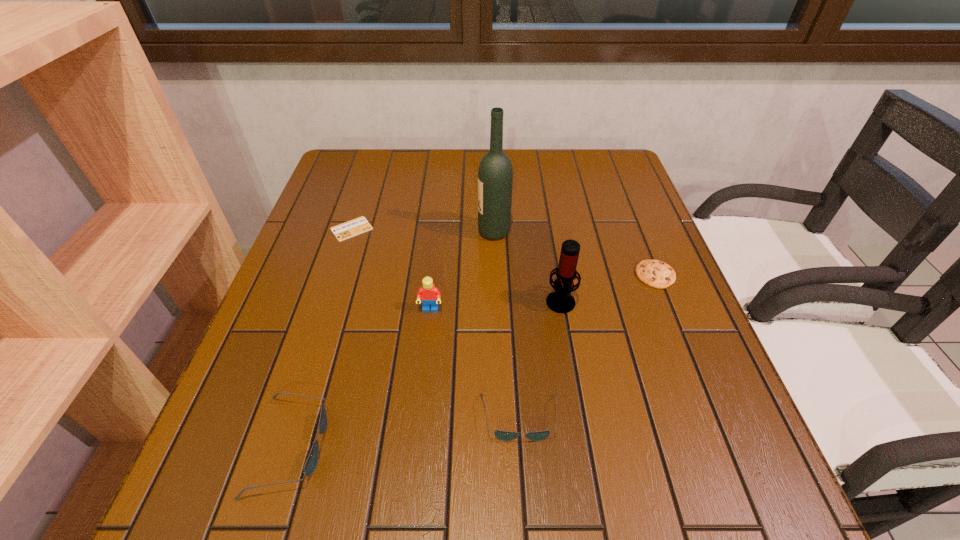
Where is `the fifth shortest object`? the fifth shortest object is located at coordinates (429, 294).

Where is `the fifth object from right to left`? Image resolution: width=960 pixels, height=540 pixels. the fifth object from right to left is located at coordinates (429, 294).

You are a GUI agent. You are given a task and a screenshot of the screen. Output one action in this format:
    pyautogui.click(x=<x>, y=<y>)
    Task: Click on the vacant space located on the lenses of the left sunglasses
    The image size is (960, 540).
    Given the screenshot: What is the action you would take?
    pyautogui.click(x=492, y=446)

Locate an element on the screen. vacant area located on the labeled side of the wine bottle is located at coordinates (377, 232).

Where is `free space located 0.400m on the labeled side of the wine bottle`? free space located 0.400m on the labeled side of the wine bottle is located at coordinates (323, 232).

Locate an element on the screen. blank space located on the labeled side of the wine bottle is located at coordinates (381, 232).

Where is `vacant region located on the back of the shortest object`? The image size is (960, 540). vacant region located on the back of the shortest object is located at coordinates (375, 156).

You are a GUI agent. You are given a task and a screenshot of the screen. Output one action in this format:
    pyautogui.click(x=<x>, y=<y>)
    Task: Click on the free location located on the left of the cookie
    The width and height of the screenshot is (960, 540).
    Given the screenshot: What is the action you would take?
    pyautogui.click(x=606, y=275)

What are the coordinates of `vacant space located on the left of the second tallest object` in the screenshot? It's located at (477, 300).

Where is `vacant region located 0.080m on the face of the third tallest object`? The image size is (960, 540). vacant region located 0.080m on the face of the third tallest object is located at coordinates (426, 346).